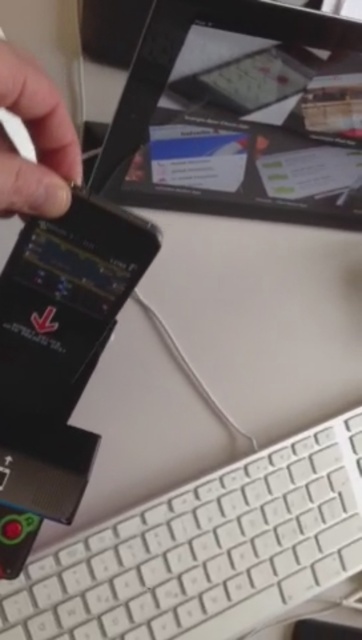
Question: Which point appears closest to the camera in this image?

Choices:
 (A) (35, 563)
 (B) (219, 99)

Answer: (A)

Question: Among these points, which one is farthest from the camera?

Choices:
 (A) (10, 214)
 (B) (119, 182)
 (C) (183, 634)

Answer: (B)

Question: Which point is closer to the camera?

Choices:
 (A) black glossy tablet at upper center
 (B) matte black finger at upper left
 (C) white plastic keyboard at lower right

Answer: (B)

Question: In this image, where is black glossy tablet at upper center located relative to matte black finger at upper left?

Choices:
 (A) left
 (B) right

Answer: (B)

Question: Does black glossy tablet at upper center come behind matte black finger at upper left?

Choices:
 (A) yes
 (B) no

Answer: (A)

Question: From the image, what is the correct spatial relationship of black glossy tablet at upper center in relation to white plastic keyboard at lower right?

Choices:
 (A) below
 (B) above

Answer: (B)